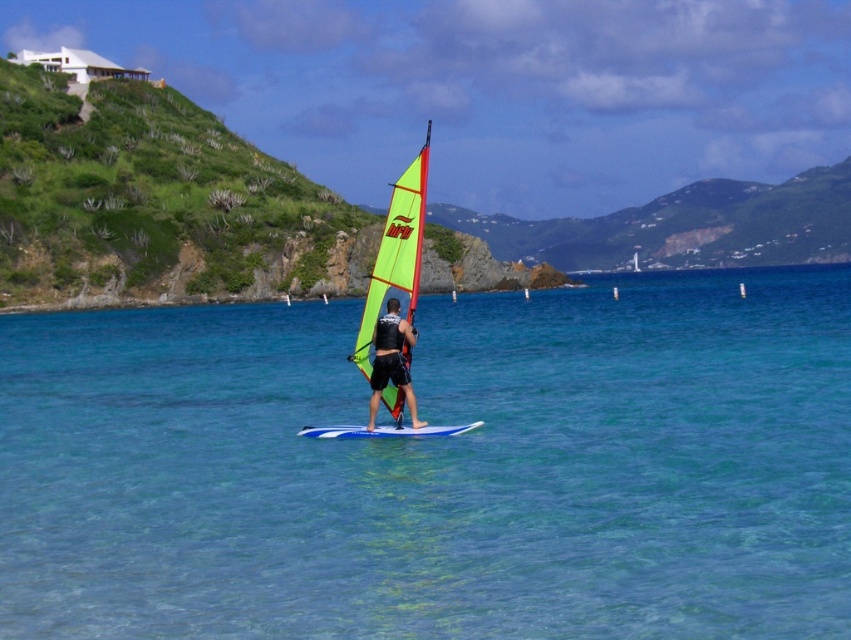
Measure the distance between green grassy hillside at upper left and neon yellow sail at center.

green grassy hillside at upper left is 84.54 meters away from neon yellow sail at center.

Is green grassy hillside at upper left further to the viewer compared to neon yellow sail at center?

Yes, it is.

Where is `green grassy hillside at upper left`? Image resolution: width=851 pixels, height=640 pixels. green grassy hillside at upper left is located at coordinates (147, 200).

Which is in front, point (227, 412) or point (420, 428)?

Point (420, 428) is more forward.

Describe the element at coordinates (437, 467) in the screenshot. The height and width of the screenshot is (640, 851). I see `clear blue water at center` at that location.

You are a GUI agent. You are given a task and a screenshot of the screen. Output one action in this format:
    pyautogui.click(x=<x>, y=<y>)
    Task: Click on the clear blue water at center
    The height and width of the screenshot is (640, 851).
    Given the screenshot: What is the action you would take?
    pyautogui.click(x=437, y=467)

Does clear blue water at center have a lesser height compared to green grassy hillside at upper left?

Indeed, clear blue water at center has a lesser height compared to green grassy hillside at upper left.

Is clear blue water at center to the left of green grassy hillside at upper left from the viewer's perspective?

No, clear blue water at center is not to the left of green grassy hillside at upper left.

This screenshot has height=640, width=851. What are the coordinates of `clear blue water at center` in the screenshot? It's located at (437, 467).

You are a GUI agent. You are given a task and a screenshot of the screen. Output one action in this format:
    pyautogui.click(x=<x>, y=<y>)
    Task: Click on the clear blue water at center
    This screenshot has height=640, width=851.
    Given the screenshot: What is the action you would take?
    pyautogui.click(x=437, y=467)